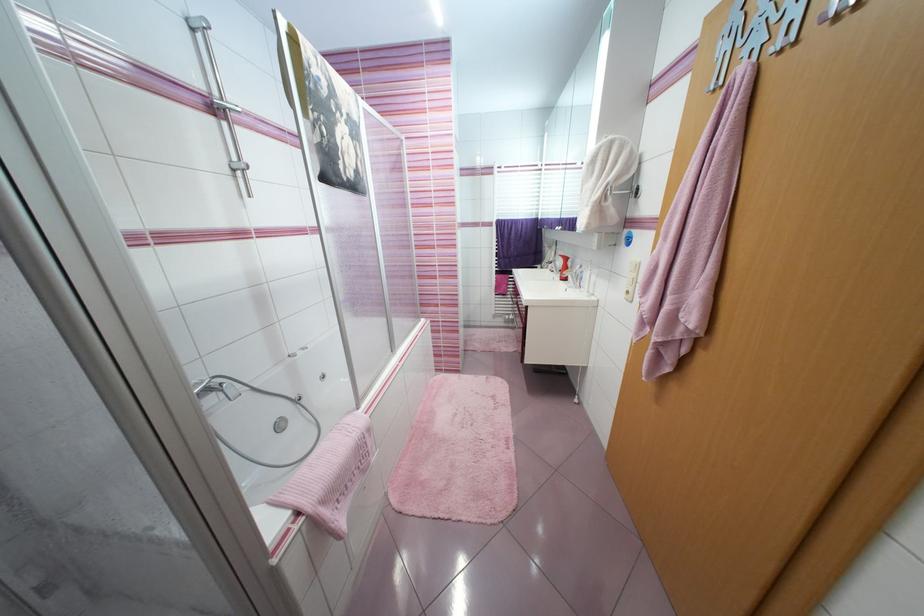
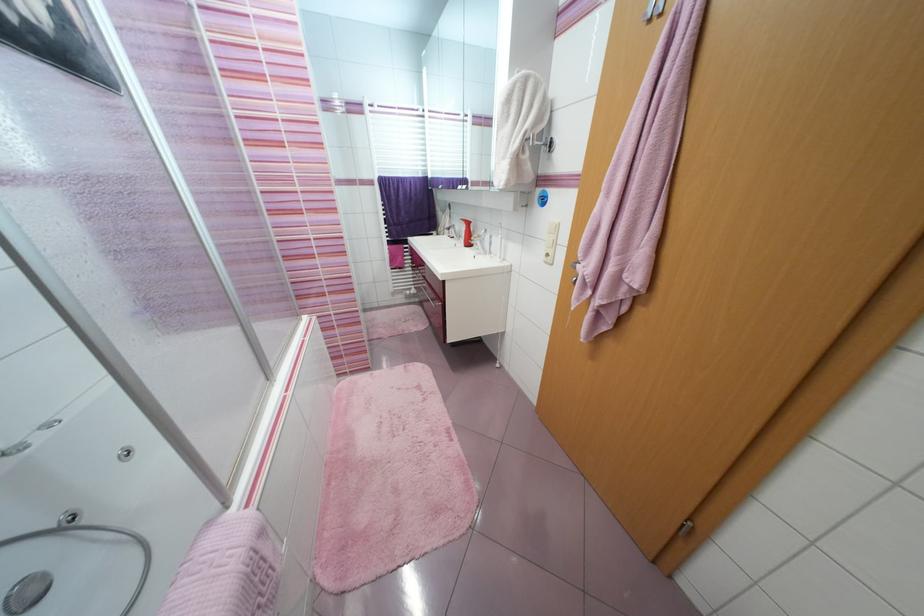
Where in the second image is the point corresponding to the point at 631,301 from the first image?

(551, 264)